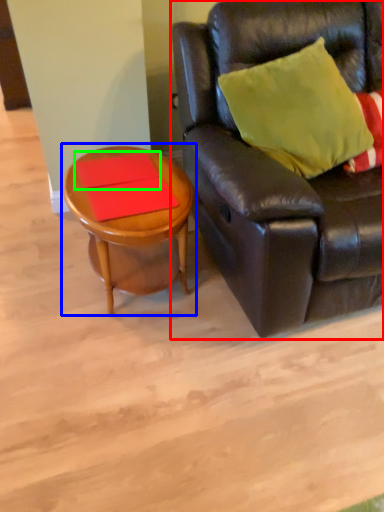
Question: Which object is positioned closest to studio couch (highlighted by a red box)? Select from coffee table (highlighted by a blue box) and plank (highlighted by a green box).

Choices:
 (A) coffee table
 (B) plank

Answer: (A)